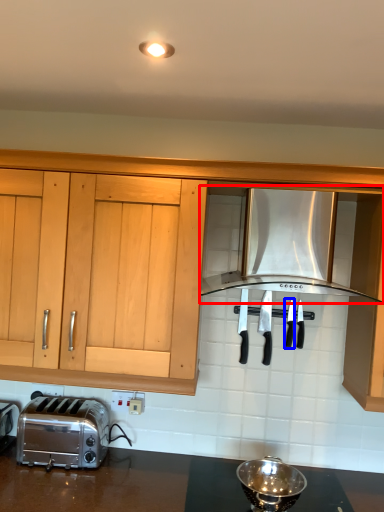
Question: Among these objects, which one is farthest to the camera, kitchen appliance (highlighted by a red box) or silverware (highlighted by a blue box)?

Choices:
 (A) kitchen appliance
 (B) silverware

Answer: (B)